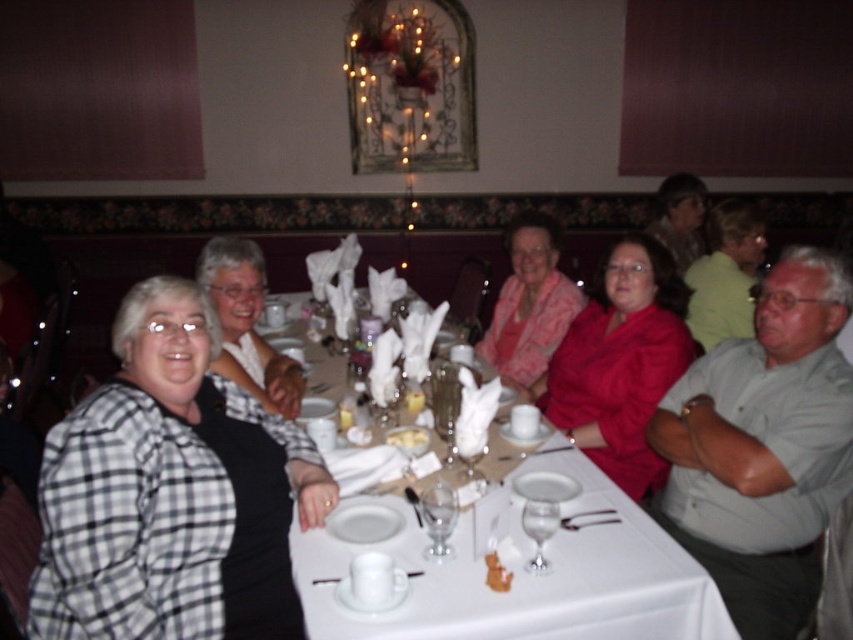
Question: Which point is farther to the camera?

Choices:
 (A) checkered fabric jacket at left
 (B) matte red blouse at center
 (C) matte black hair at upper right
 (D) white porcelain plate at center

Answer: (C)

Question: Which object appears closest to the camera in this image?

Choices:
 (A) pink satin blouse at center
 (B) matte red blouse at center
 (C) matte green blouse at upper right
 (D) checkered fabric jacket at left

Answer: (D)

Question: Can you confirm if matte green blouse at upper right is smaller than matte black hair at upper right?

Choices:
 (A) no
 (B) yes

Answer: (A)

Question: In this image, where is white porcelain plates at center located relative to white porcelain plate at center?

Choices:
 (A) right
 (B) left

Answer: (A)

Question: Is white porcelain plates at center bigger than black checkered shirt at left?

Choices:
 (A) no
 (B) yes

Answer: (B)

Question: Based on their relative distances, which object is nearer to the matte green blouse at upper right?

Choices:
 (A) checkered fabric jacket at left
 (B) matte red blouse at center
 (C) black checkered shirt at left
 (D) white porcelain plate at center

Answer: (B)